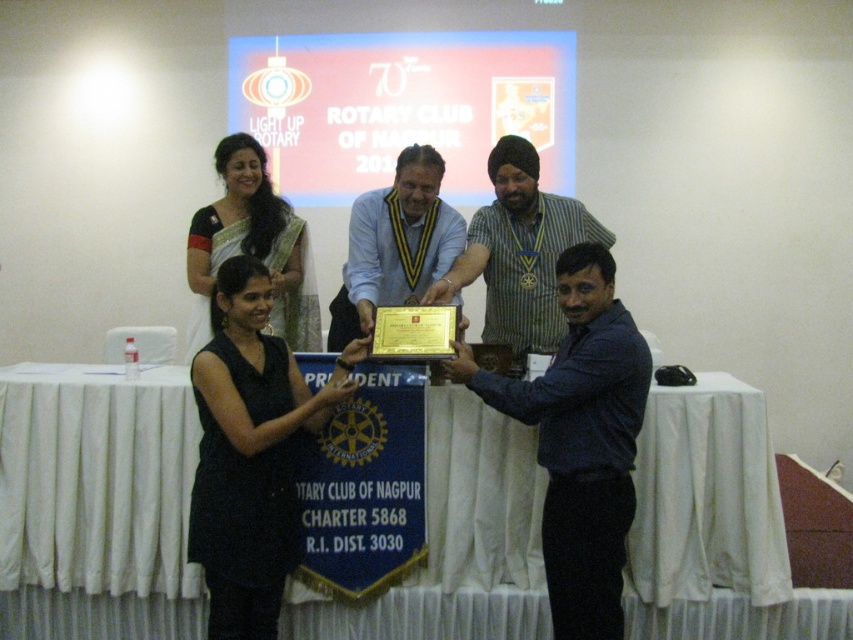
Is black dress at center positioned in front of green silk saree at upper left?

That is True.

Between point (216, 576) and point (190, 248), which one is positioned behind?

Positioned behind is point (190, 248).

You are a GUI agent. You are given a task and a screenshot of the screen. Output one action in this format:
    pyautogui.click(x=<x>, y=<y>)
    Task: Click on the black dress at center
    The width and height of the screenshot is (853, 640).
    Given the screenshot: What is the action you would take?
    pyautogui.click(x=250, y=452)

Consider the image. Can you confirm if matte gold plaque at center is positioned to the left of gold plated plaque at center?

In fact, matte gold plaque at center is to the right of gold plated plaque at center.

Describe the element at coordinates (518, 252) in the screenshot. I see `matte gold plaque at center` at that location.

Who is more forward, [519,237] or [463,234]?

Point [519,237]

The width and height of the screenshot is (853, 640). Find the location of `matte gold plaque at center`. matte gold plaque at center is located at coordinates (518, 252).

Can you confirm if black dress at center is positioned to the right of matte gold plaque at center?

In fact, black dress at center is to the left of matte gold plaque at center.

Can you confirm if black dress at center is positioned to the left of matte gold plaque at center?

Correct, you'll find black dress at center to the left of matte gold plaque at center.

What are the coordinates of `black dress at center` in the screenshot? It's located at (250, 452).